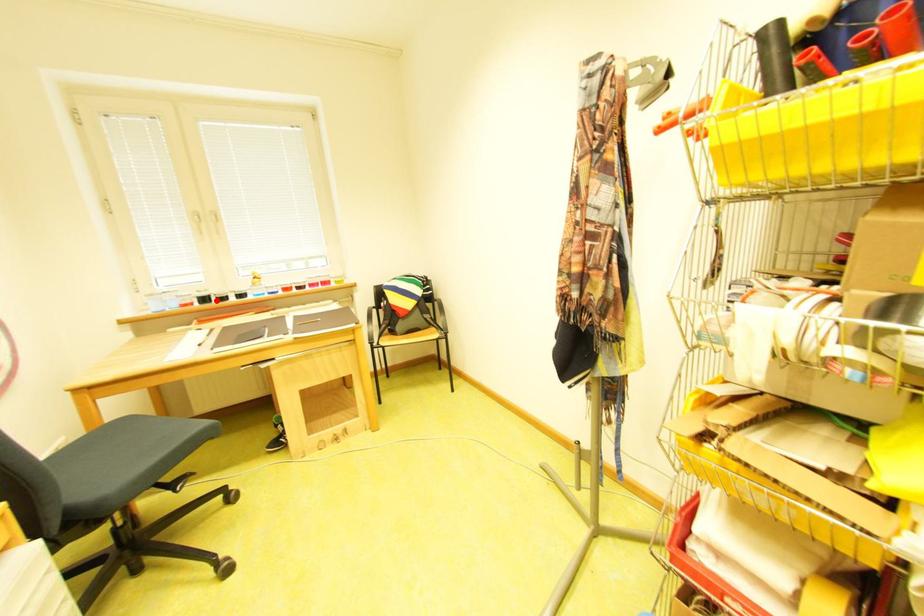
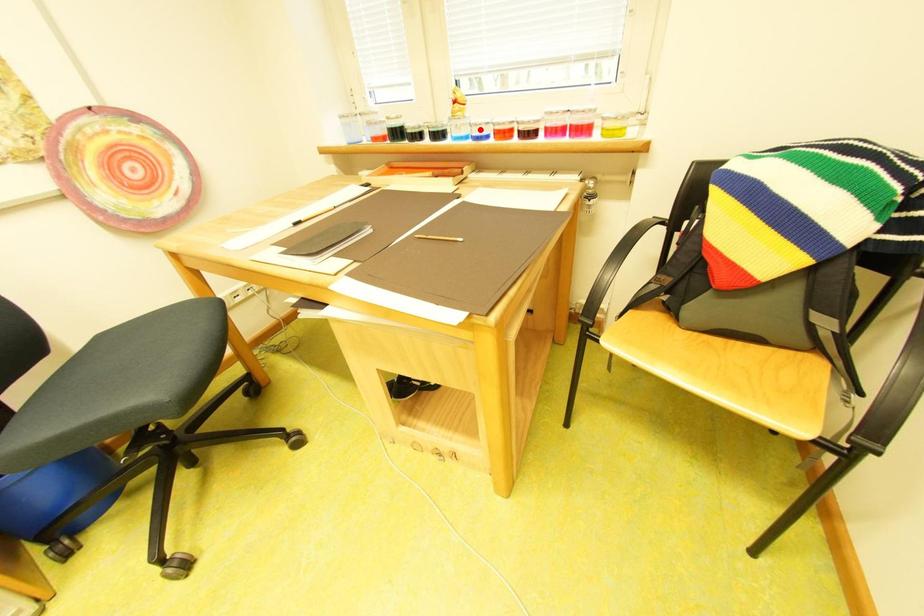
I am providing you with two images of the same scene from different viewpoints. A red point is marked on the first image and another point is marked on the second image. Are the points marked in image1 and image2 representing the same 3D position?

No